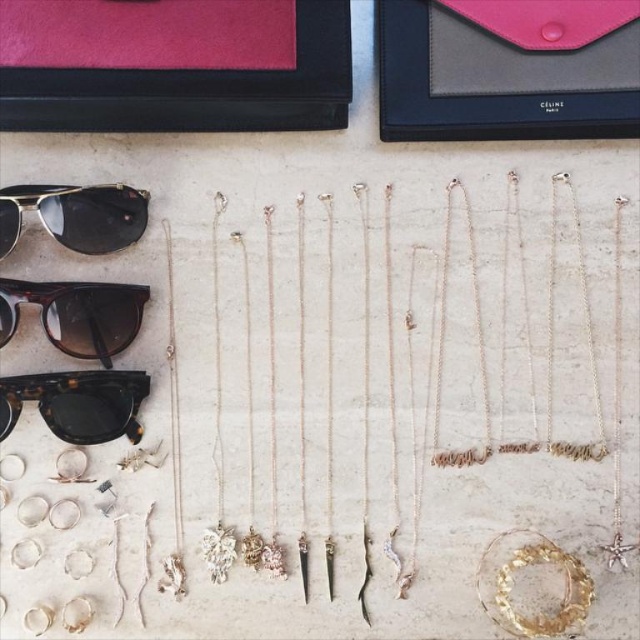
This screenshot has width=640, height=640. In order to click on brown tortoiseshell sunglasses at upper left in this screenshot , I will do `click(76, 314)`.

Is brown tortoiseshell sunglasses at upper left to the right of metallic reflective sunglasses at upper left from the viewer's perspective?

Incorrect, brown tortoiseshell sunglasses at upper left is not on the right side of metallic reflective sunglasses at upper left.

Is point (64, 296) behind point (12, 241)?

Yes, it is behind point (12, 241).

Locate an element on the screen. This screenshot has width=640, height=640. brown tortoiseshell sunglasses at upper left is located at coordinates (76, 314).

Between brown tortoiseshell sunglasses at upper left and tortoiseshell acetate sunglasses at lower left, which one appears on the right side from the viewer's perspective?

From the viewer's perspective, tortoiseshell acetate sunglasses at lower left appears more on the right side.

Which is more to the left, brown tortoiseshell sunglasses at upper left or tortoiseshell acetate sunglasses at lower left?

brown tortoiseshell sunglasses at upper left

This screenshot has width=640, height=640. Describe the element at coordinates (76, 314) in the screenshot. I see `brown tortoiseshell sunglasses at upper left` at that location.

Locate an element on the screen. brown tortoiseshell sunglasses at upper left is located at coordinates (76, 314).

Is point (76, 416) more distant than point (60, 216)?

Yes, point (76, 416) is farther from viewer.

Is tortoiseshell acetate sunglasses at lower left to the left of metallic reflective sunglasses at upper left from the viewer's perspective?

In fact, tortoiseshell acetate sunglasses at lower left is to the right of metallic reflective sunglasses at upper left.

Does point (72, 385) lie in front of point (116, 241)?

Yes.

Find the location of a particular element. Image resolution: width=640 pixels, height=640 pixels. tortoiseshell acetate sunglasses at lower left is located at coordinates (77, 403).